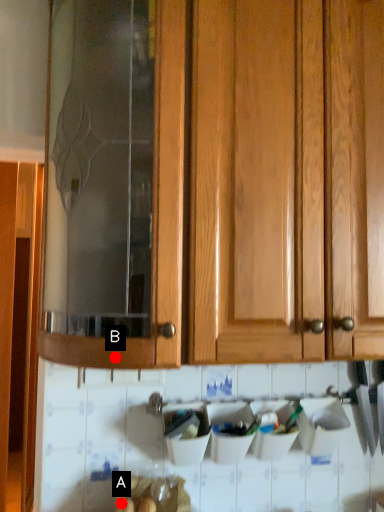
Question: Two points are circled on the image, labeled by A and B beside each circle. Among these points, which one is farthest from the camera?

Choices:
 (A) A is further
 (B) B is further

Answer: (A)